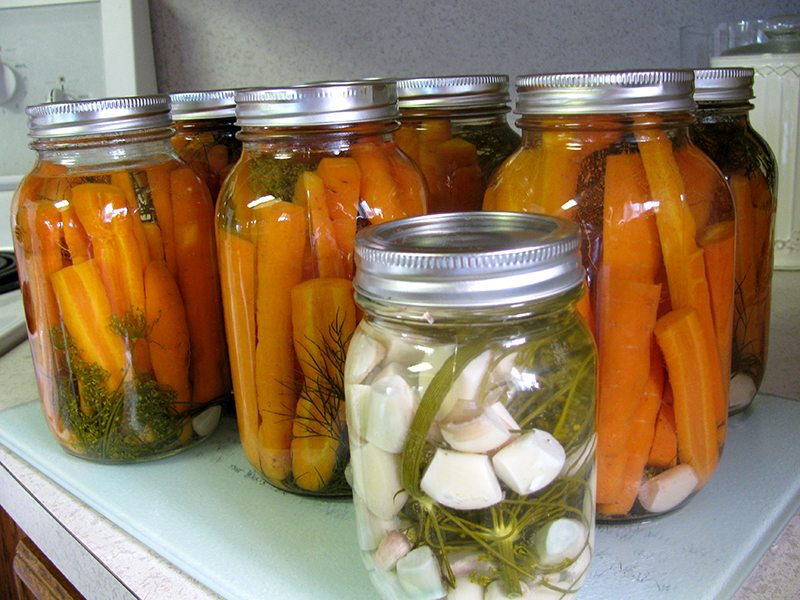
The image size is (800, 600). I want to click on jars, so click(x=578, y=171).